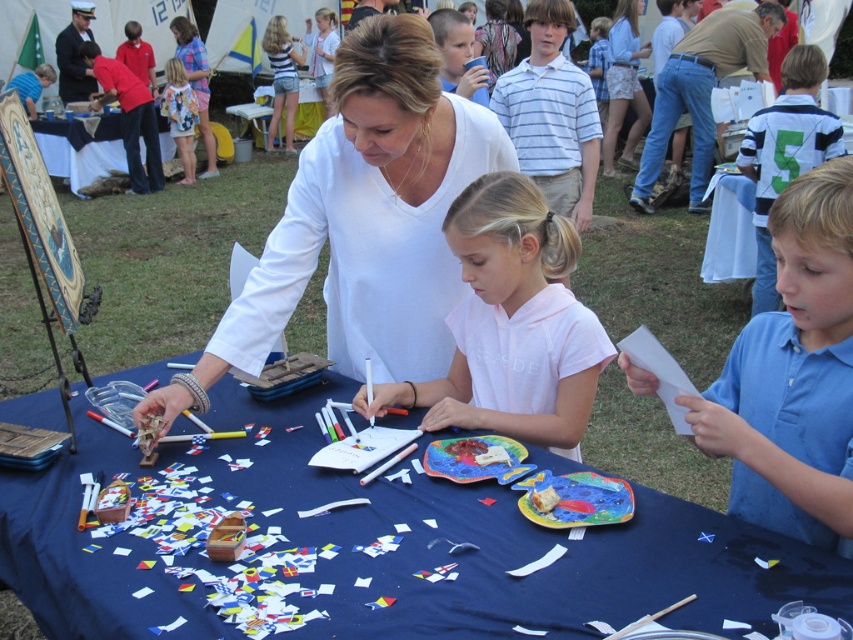
You are a participant at this event and want to reach the craft materials on the blue fabric table at center without disturbing the blue smooth shirt at right. Is there enough space to move around the table?

The blue fabric table at center is in front of the blue smooth shirt at right, so there should be enough space to move around the table without disturbing the shirt.

You are a participant at this event and need to place a heavy box on a table. Which table, the blue fabric table at center or the white plastic table at upper left, can support the box better based on their heights?

The white plastic table at upper left is taller than the blue fabric table at center, so it likely has a stronger structure and can support the box better.

You are a participant at the craft event and want to place a craft kit on the white plastic table at upper left. However, there is a floral fabric dress at upper left above it. Can you place the kit directly on the table without moving the dress?

The white plastic table at upper left is positioned under the floral fabric dress at upper left, so you cannot place the craft kit directly on the table without moving the dress.